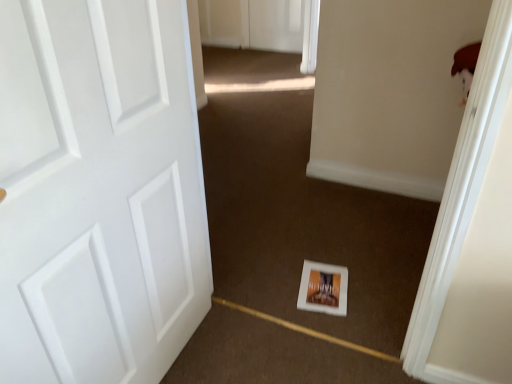
Question: Does point (194, 178) appear closer or farther from the camera than point (330, 283)?

Choices:
 (A) closer
 (B) farther

Answer: (A)

Question: From a real-world perspective, is white matte door at left above or below white matte postcard at center?

Choices:
 (A) below
 (B) above

Answer: (B)

Question: From the image's perspective, is white matte door at left above or below white matte postcard at center?

Choices:
 (A) below
 (B) above

Answer: (B)

Question: Is point (345, 299) closer or farther from the camera than point (180, 76)?

Choices:
 (A) closer
 (B) farther

Answer: (B)

Question: Looking at the image, does white matte postcard at center seem bigger or smaller compared to white matte door at left?

Choices:
 (A) big
 (B) small

Answer: (B)

Question: From the image's perspective, is white matte postcard at center located above or below white matte door at left?

Choices:
 (A) below
 (B) above

Answer: (A)

Question: Is white matte postcard at center inside or outside of white matte door at left?

Choices:
 (A) outside
 (B) inside

Answer: (A)